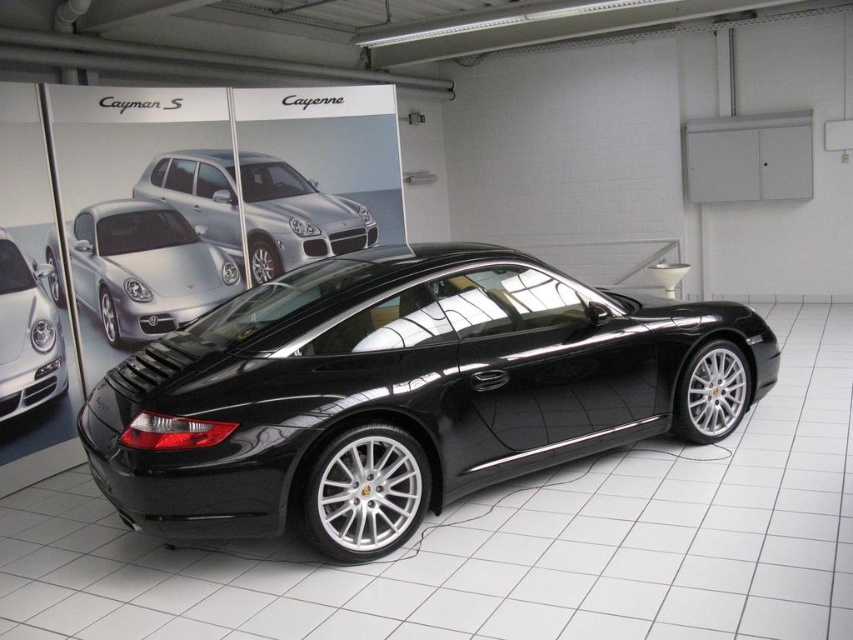
You are a customer in a Porsche showroom and want to take a closer look at the shiny silver sedan at center and the satin silver headlight at center. Which one can you reach first if you walk straight towards them?

The shiny silver sedan at center is closer to you than the satin silver headlight at center, so you can reach it first.

You are standing in the Porsche showroom and want to take a photo of the car. The camera you are using has a minimum focusing distance of 5 meters. Can you take a clear photo of the point at coordinates point (56, 304) without moving closer?

The point at coordinates point (56, 304) is 4.77 meters from the camera, which is less than the minimum focusing distance of 5 meters. Therefore, you cannot take a clear photo of the point at coordinates point (56, 304) without moving closer.

You are a delivery person with a package that is 24 inches long. You need to place it between the shiny silver sedan at center and the satin silver headlight at center. Is there enough space to fit the package horizontally between them?

The distance between the shiny silver sedan at center and the satin silver headlight at center is 22.96 inches. Since the package is 24 inches long, it would not fit horizontally between them as the space is slightly smaller than the package.